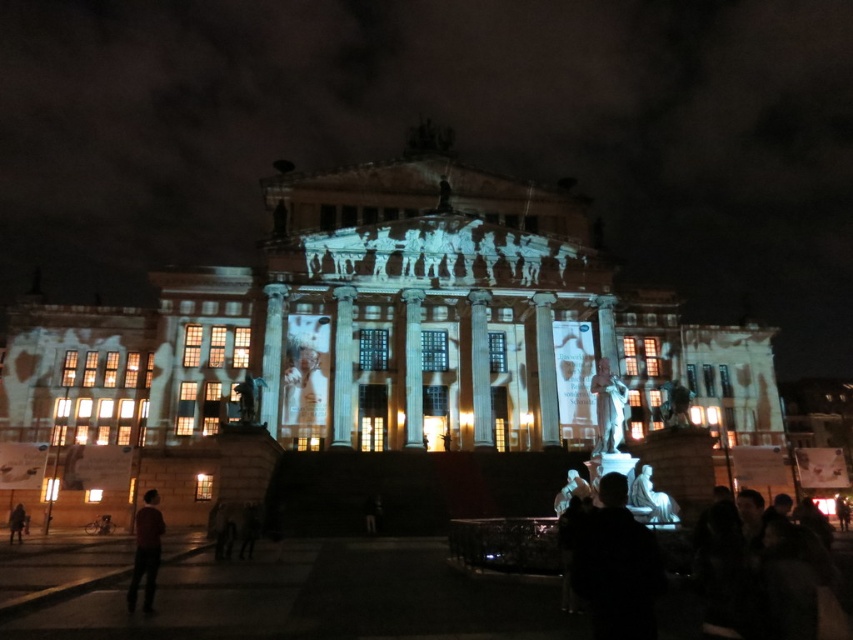
Question: Is polished bronze statue at center closer to the viewer compared to white marble statue at center?

Choices:
 (A) no
 (B) yes

Answer: (A)

Question: Which point appears farthest from the camera in this image?

Choices:
 (A) (144, 593)
 (B) (631, 493)

Answer: (B)

Question: Can you confirm if black matte statue at lower center is wider than polished bronze statue at center?

Choices:
 (A) yes
 (B) no

Answer: (A)

Question: Among these points, which one is nearest to the camera?

Choices:
 (A) (650, 556)
 (B) (13, 532)
 (C) (605, 369)
 (D) (668, 506)

Answer: (A)

Question: Considering the relative positions of polished bronze statue at center and white marble statue at center in the image provided, where is polished bronze statue at center located with respect to white marble statue at center?

Choices:
 (A) left
 (B) right

Answer: (A)

Question: Which point is farther from the camera taking this photo?

Choices:
 (A) (631, 544)
 (B) (639, 481)
 (C) (148, 557)
 (D) (12, 513)

Answer: (D)